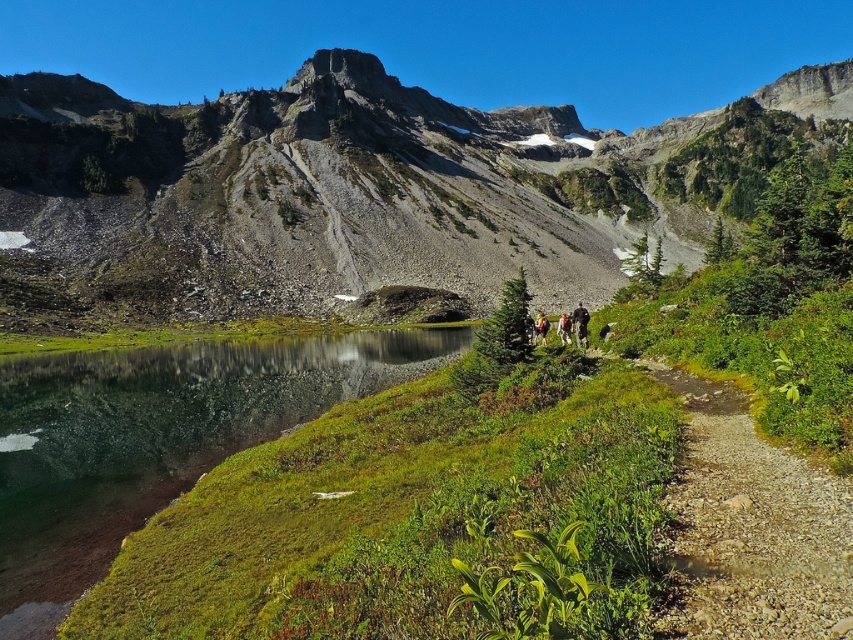
Who is higher up, dark blue jacket at center-right or dark gray jacket at center?

dark blue jacket at center-right is above.

Is point (578, 307) closer to camera compared to point (566, 328)?

No, it is not.

I want to click on dark blue jacket at center-right, so click(x=579, y=324).

The height and width of the screenshot is (640, 853). In order to click on rugged granite mountain at center in this screenshot , I will do `click(367, 193)`.

Where is `rugged granite mountain at center`? This screenshot has height=640, width=853. rugged granite mountain at center is located at coordinates (367, 193).

At what (x,y) coordinates should I click in order to perform the action: click on rugged granite mountain at center. Please return your answer as a coordinate pair (x, y). Looking at the image, I should click on (367, 193).

Who is lower down, clear glass lake at lower left or dark blue jacket at center-right?

Positioned lower is clear glass lake at lower left.

Is point (55, 406) closer to viewer compared to point (579, 330)?

That is True.

The height and width of the screenshot is (640, 853). Describe the element at coordinates (155, 440) in the screenshot. I see `clear glass lake at lower left` at that location.

Find the location of `clear glass lake at lower left`. clear glass lake at lower left is located at coordinates (155, 440).